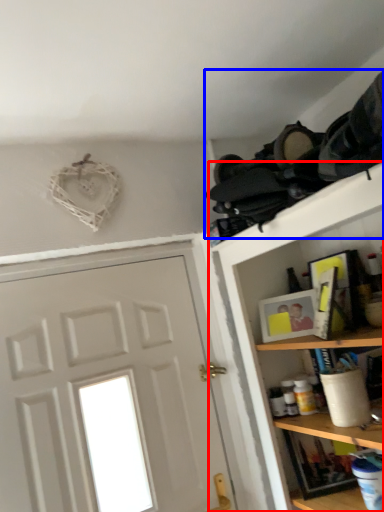
Question: Which of the following is the closest to the observer, shelf (highlighted by a red box) or laundry (highlighted by a blue box)?

Choices:
 (A) shelf
 (B) laundry

Answer: (A)